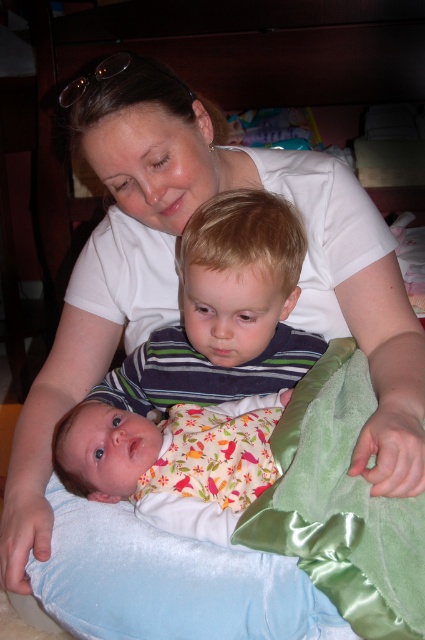
From the picture: Is striped fabric shirt at center in front of floral fabric baby at lower left?

No, striped fabric shirt at center is behind floral fabric baby at lower left.

Is point (189, 237) farther from viewer compared to point (167, 438)?

Yes, it is behind point (167, 438).

The width and height of the screenshot is (425, 640). I want to click on striped fabric shirt at center, so click(x=226, y=314).